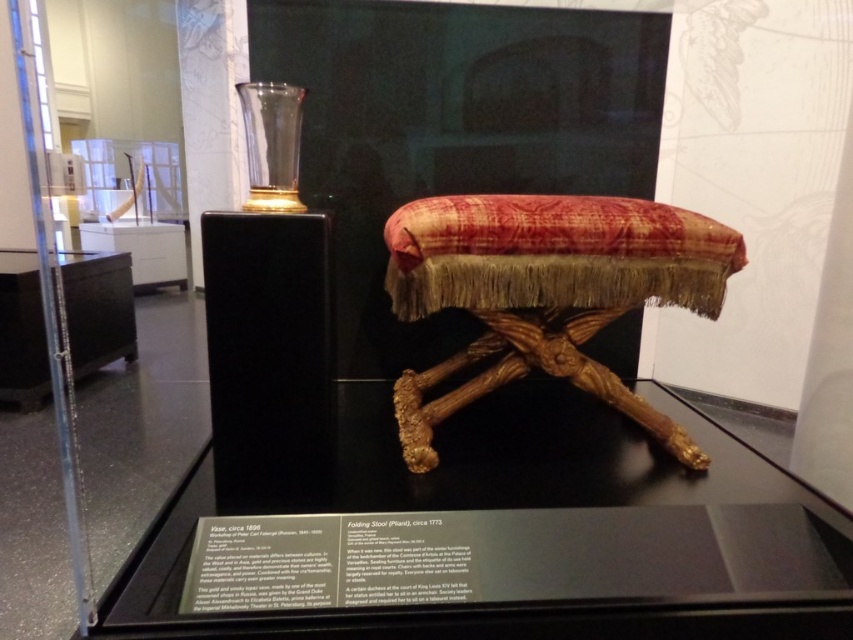
You are a visitor standing in front of the museum display case. You notice two points marked on the case. One is at coordinate point (804, 529) and the other at point (459, 406). Which point is closer to you as you face the display?

Point (804, 529) is in front of point (459, 406), so the point closer to you is point (804, 529).